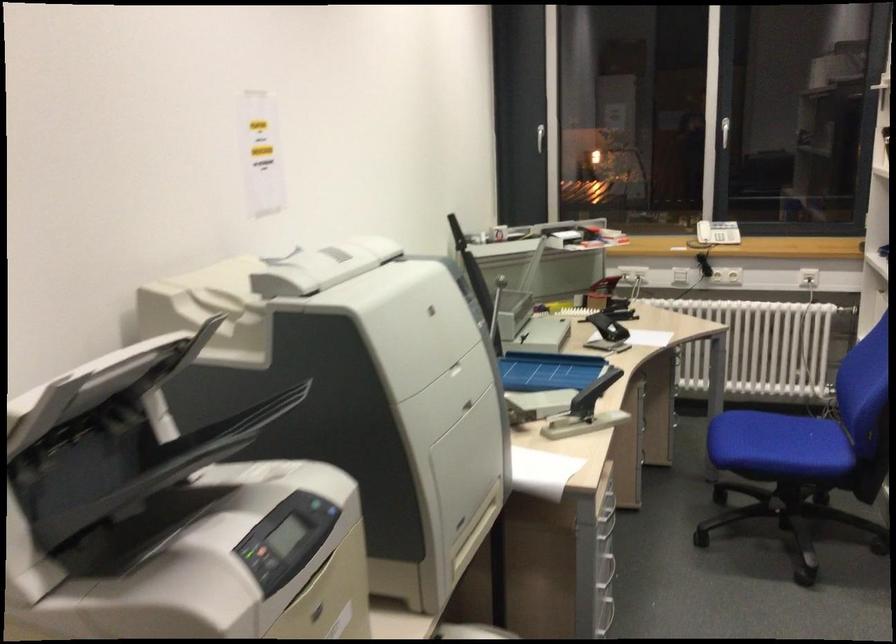
Where would you press the printer control buttons? Please return your answer as a coordinate pair (x, y).

(278, 543)